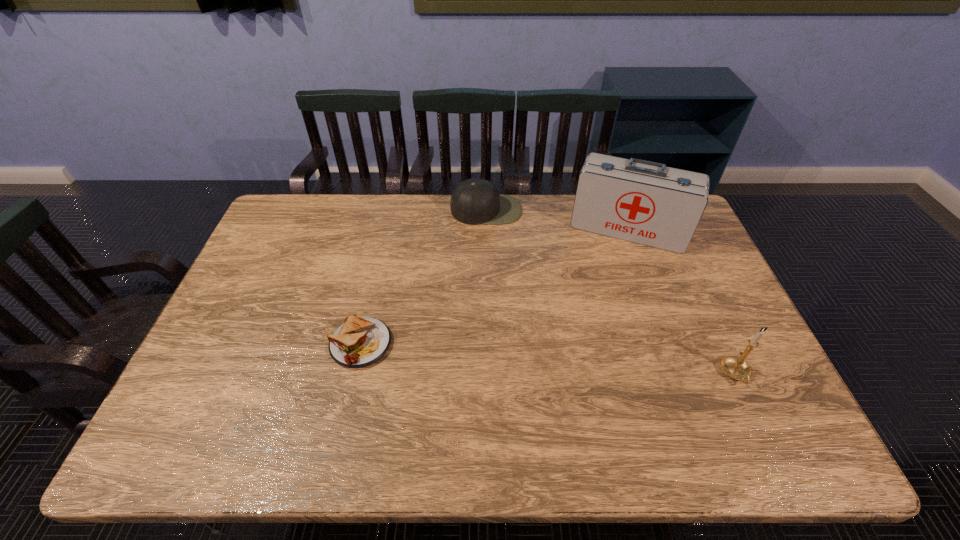
The image size is (960, 540). What are the coordinates of `the shortest object` in the screenshot? It's located at (361, 341).

Locate an element on the screen. This screenshot has width=960, height=540. sandwich is located at coordinates (361, 341).

This screenshot has width=960, height=540. In order to click on the third shortest object in this screenshot , I will do `click(736, 367)`.

Locate an element on the screen. The height and width of the screenshot is (540, 960). the tallest object is located at coordinates (644, 202).

Locate an element on the screen. Image resolution: width=960 pixels, height=540 pixels. cap is located at coordinates (474, 201).

The image size is (960, 540). What are the coordinates of `the second shortest object` in the screenshot? It's located at (474, 201).

The image size is (960, 540). What are the coordinates of `vacant space located on the back of the sandwich` in the screenshot? It's located at (369, 306).

Identify the location of free space located 0.050m on the handle side of the third shortest object. The image size is (960, 540). (752, 409).

Where is `vacant region located on the front-facing side of the tallest object`? The height and width of the screenshot is (540, 960). vacant region located on the front-facing side of the tallest object is located at coordinates (589, 345).

Image resolution: width=960 pixels, height=540 pixels. I want to click on vacant space situated 0.060m on the front-facing side of the tallest object, so click(611, 265).